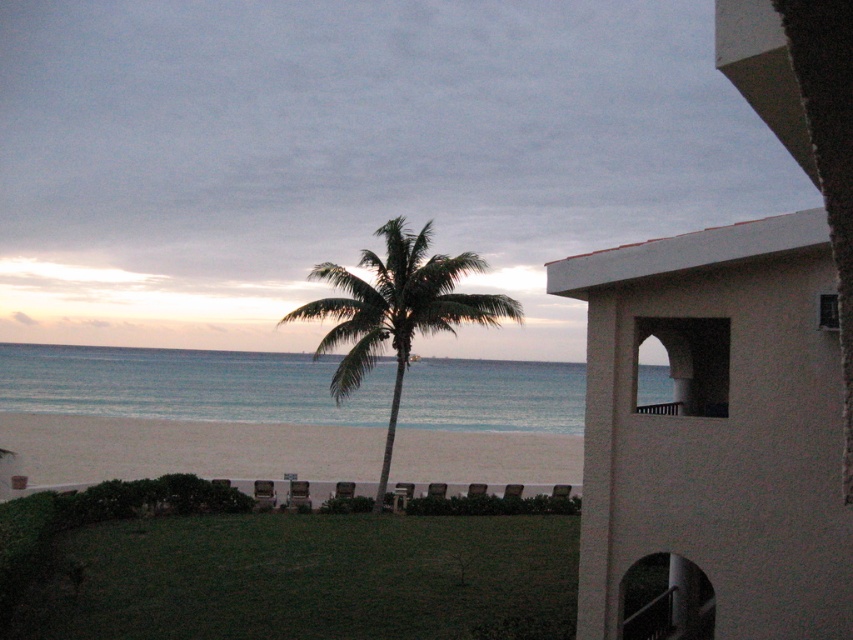
You are a photographer planning to capture the entire white stucco building at right and green leafy palm tree at center in a single frame. Based on their sizes, which object would require you to step back further to include both fully in the photo?

The green leafy palm tree at center is wider than the white stucco building at right, so you would need to step back further to include the green leafy palm tree at center in the photo.

You are standing on the beach and want to take a photo of the green leafy palm tree at center without the blue water at center in the background. Is this possible given their positions?

The blue water at center is in front of the green leafy palm tree at center, so you cannot take a photo of the green leafy palm tree at center without the blue water at center in the background.

You are a maintenance worker needing to reach both the white stucco building at right and the green leafy palm tree at center. If you start from the lawn, which one would you reach first?

A: The green leafy palm tree at center is closer to the lawn than the white stucco building at right, so you would reach the green leafy palm tree at center first.